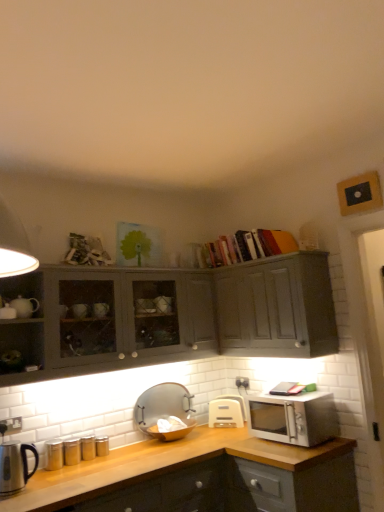
Question: Does matte gray cabinet at upper right, marked as the 2th cabinetry in a left-to-right arrangement, have a greater width compared to satin silver microwave at right?

Choices:
 (A) yes
 (B) no

Answer: (B)

Question: From a real-world perspective, is matte gray cabinet at upper right, acting as the first cabinetry starting from the right, over satin silver microwave at right?

Choices:
 (A) no
 (B) yes

Answer: (B)

Question: Considering the relative positions of matte gray cabinet at upper right, acting as the first cabinetry starting from the right, and satin silver microwave at right in the image provided, is matte gray cabinet at upper right, acting as the first cabinetry starting from the right, in front of satin silver microwave at right?

Choices:
 (A) no
 (B) yes

Answer: (A)

Question: Is matte gray cabinet at upper right, marked as the 2th cabinetry in a left-to-right arrangement, shorter than satin silver microwave at right?

Choices:
 (A) yes
 (B) no

Answer: (B)

Question: Is matte gray cabinet at upper right, acting as the first cabinetry starting from the right, facing away from satin silver microwave at right?

Choices:
 (A) no
 (B) yes

Answer: (A)

Question: Is satin silver microwave at right a part of matte gray cabinet at upper right, acting as the first cabinetry starting from the right?

Choices:
 (A) no
 (B) yes

Answer: (A)

Question: From the image's perspective, is white plastic electric outlet at lower left on transparent glass bowl at center, the 2th appliance viewed from the front?

Choices:
 (A) yes
 (B) no

Answer: (A)

Question: Is white plastic electric outlet at lower left in contact with transparent glass bowl at center, the 2th appliance viewed from the front?

Choices:
 (A) yes
 (B) no

Answer: (B)

Question: Is white plastic electric outlet at lower left at the right side of transparent glass bowl at center, which is the 2th appliance in left-to-right order?

Choices:
 (A) no
 (B) yes

Answer: (A)

Question: Does white plastic electric outlet at lower left have a greater height compared to transparent glass bowl at center, which is the 2th appliance in left-to-right order?

Choices:
 (A) no
 (B) yes

Answer: (A)

Question: Is white plastic electric outlet at lower left bigger than transparent glass bowl at center, arranged as the 2th appliance when viewed from the right?

Choices:
 (A) no
 (B) yes

Answer: (A)

Question: Would you say white plastic electric outlet at lower left contains transparent glass bowl at center, arranged as the 2th appliance when viewed from the right?

Choices:
 (A) no
 (B) yes

Answer: (A)

Question: Is the position of matte gray cabinet at upper right, acting as the first cabinetry starting from the right, more distant than that of white plastic electric outlet at lower left?

Choices:
 (A) yes
 (B) no

Answer: (A)